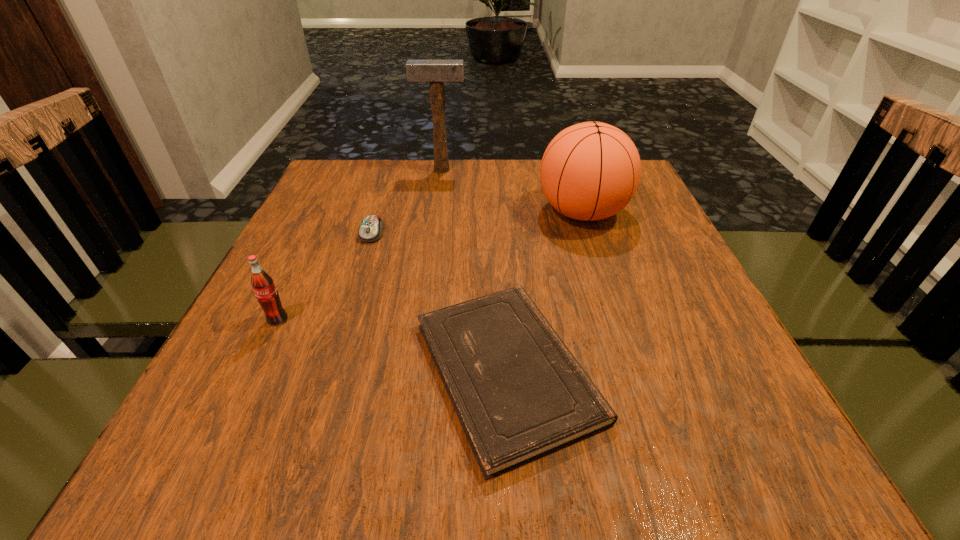
At what (x,y) coordinates should I click in order to perform the action: click on vacant area that lies between the third tallest object and the fourth shortest object. Please return your answer as a coordinate pair (x, y). The width and height of the screenshot is (960, 540). Looking at the image, I should click on (430, 266).

Locate an element on the screen. Image resolution: width=960 pixels, height=540 pixels. free area in between the soda bottle and the tallest object is located at coordinates [360, 245].

The height and width of the screenshot is (540, 960). I want to click on free space between the fourth object from right to left and the fourth shortest object, so click(477, 222).

Locate an element on the screen. The width and height of the screenshot is (960, 540). vacant area that lies between the second object from left to right and the farthest object is located at coordinates (406, 201).

Identify the location of vacant space that's between the fourth object from right to left and the tallest object. This screenshot has width=960, height=540. (406, 201).

You are a GUI agent. You are given a task and a screenshot of the screen. Output one action in this format:
    pyautogui.click(x=<x>, y=<y>)
    Task: Click on the free space between the paperback book and the fourth object from right to left
    
    Given the screenshot: What is the action you would take?
    pyautogui.click(x=440, y=302)

The height and width of the screenshot is (540, 960). I want to click on object that is the closest to the second object from left to right, so click(519, 393).

Image resolution: width=960 pixels, height=540 pixels. In order to click on object that stands as the second closest to the paperback book in this screenshot , I will do `click(371, 229)`.

Where is `free spot that satisfies the following two spatial constraints: 1. on the back side of the paperback book; 2. on the left side of the basketball`? Image resolution: width=960 pixels, height=540 pixels. free spot that satisfies the following two spatial constraints: 1. on the back side of the paperback book; 2. on the left side of the basketball is located at coordinates (498, 212).